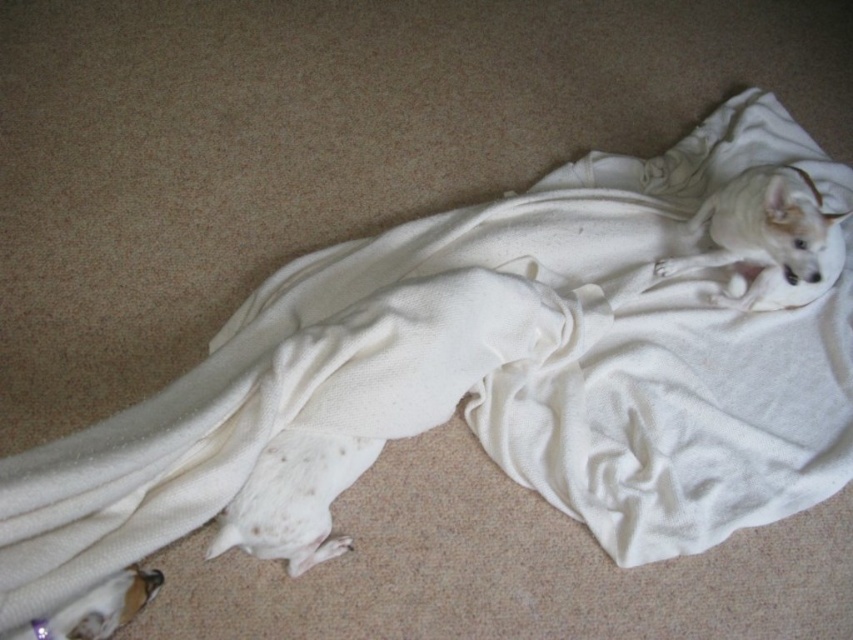
Is white soft dog at upper right below white soft fur dog at lower left?

No.

Between point (758, 300) and point (28, 620), which one is positioned in front?

Positioned in front is point (28, 620).

Which is in front, point (666, 259) or point (132, 577)?

Positioned in front is point (132, 577).

The image size is (853, 640). I want to click on white soft dog at upper right, so click(x=767, y=240).

Between white soft dog at lower left and white soft fur dog at lower left, which one is positioned lower?

white soft fur dog at lower left

Is point (312, 436) farther from viewer compared to point (103, 624)?

Yes.

At what (x,y) coordinates should I click in order to perform the action: click on white soft dog at lower left. Please return your answer as a coordinate pair (x, y). The width and height of the screenshot is (853, 640). Looking at the image, I should click on (293, 499).

Find the location of a particular element. This screenshot has height=640, width=853. white soft dog at lower left is located at coordinates (293, 499).

Measure the distance between white soft dog at upper right and camera.

They are 4.45 feet apart.

Can you confirm if white soft dog at upper right is positioned below white soft dog at lower left?

No.

Image resolution: width=853 pixels, height=640 pixels. Describe the element at coordinates (767, 240) in the screenshot. I see `white soft dog at upper right` at that location.

Identify the location of white soft dog at upper right. (767, 240).